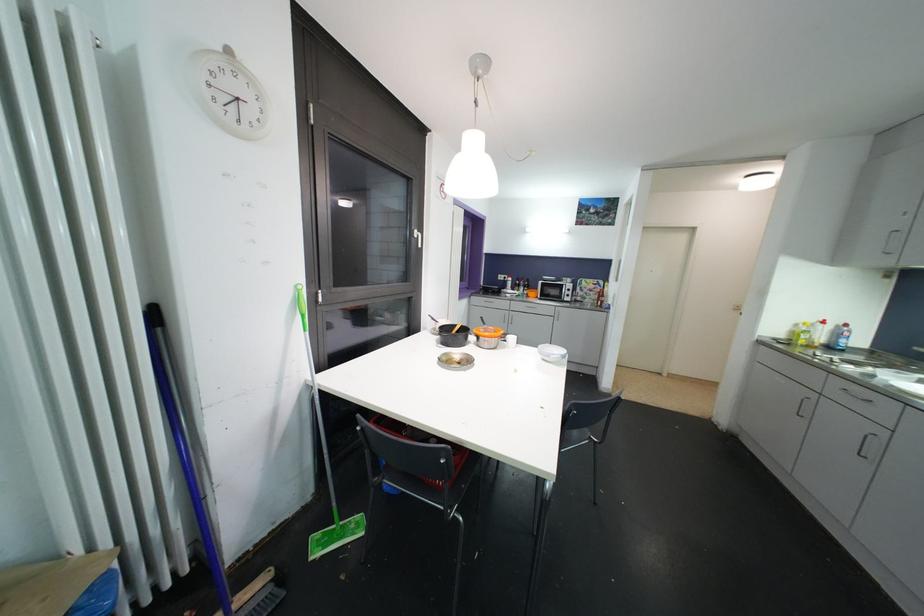
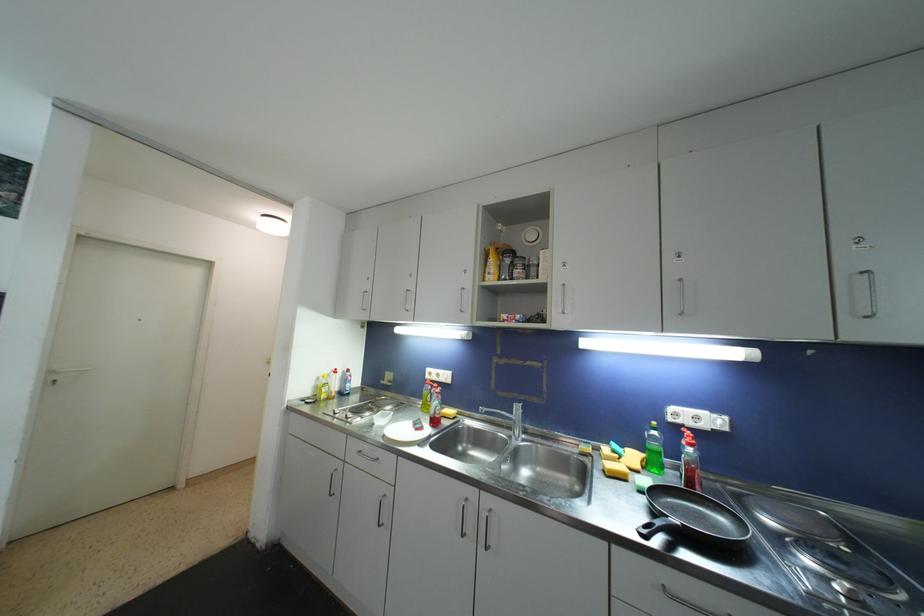
The point at (796, 336) is marked in the first image. Where is the corresponding point in the second image?

(321, 391)